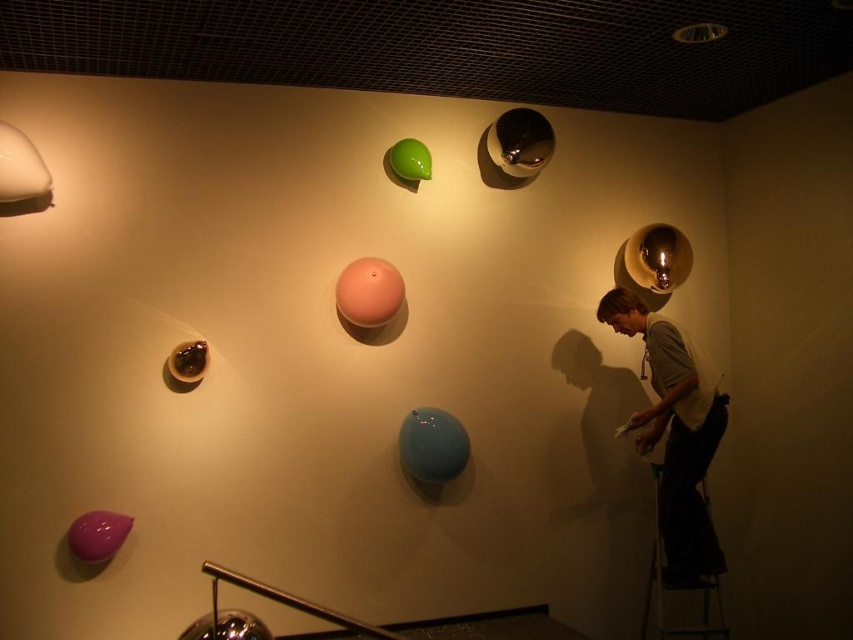
What is the exact coordinate of the white cotton shirt at right?

The white cotton shirt at right is located at coordinate point [674,435].